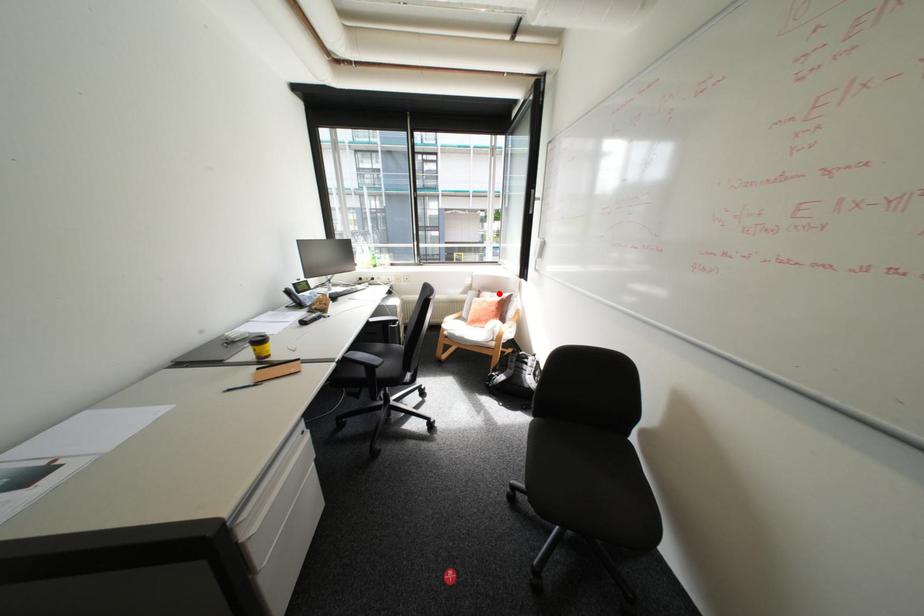
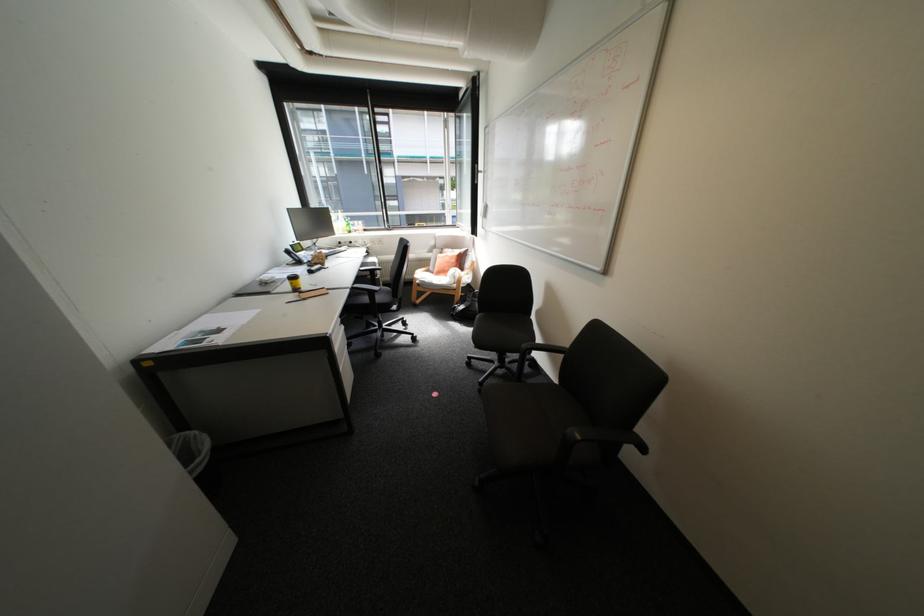
Question: I am providing you with two images of the same scene from different viewpoints. A red point is shown in image1. For the corresponding object point in image2, is it positioned nearer or farther from the camera?

Choices:
 (A) Nearer
 (B) Farther

Answer: (A)